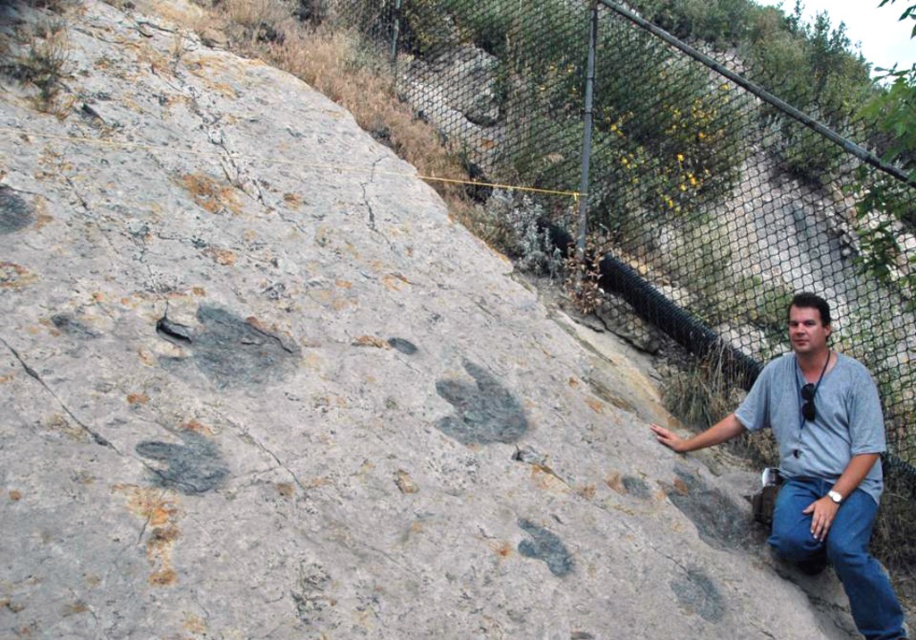
You are a photographer wanting to capture both the metal mesh fence at upper right and the gray cotton shirt at lower right in the same frame. Which object should you focus on first if you want to ensure both are in focus without moving the camera?

The metal mesh fence at upper right has a lesser width compared to the gray cotton shirt at lower right, so you should focus on the gray cotton shirt at lower right first since it is wider and will require a smaller depth of field to keep both in focus.

Based on the photo, you are standing at the base of the rock with the fossilized handprints. You notice a point marked at coordinates (669, 176). What object is located at that point?

The point at coordinates (669, 176) is on the metal mesh fence at upper right.